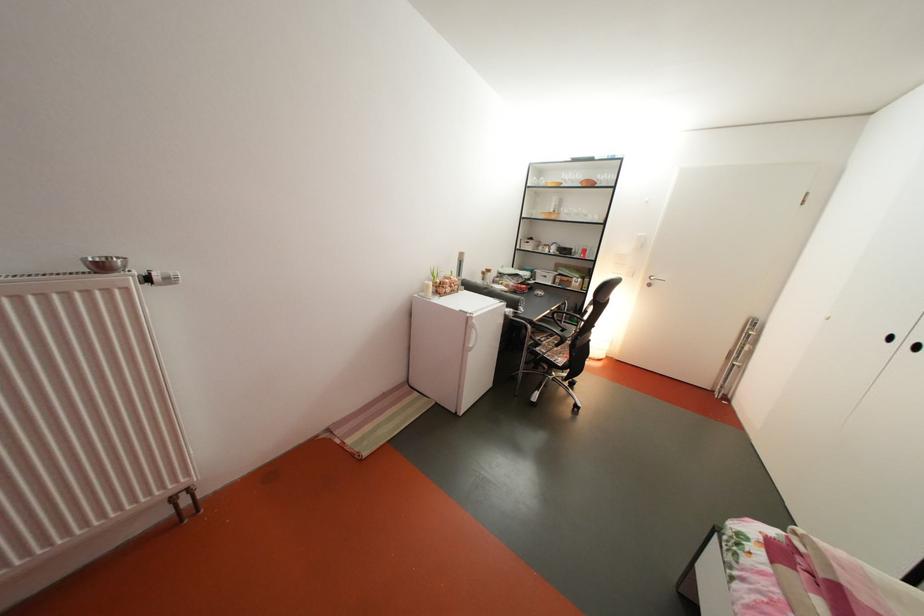
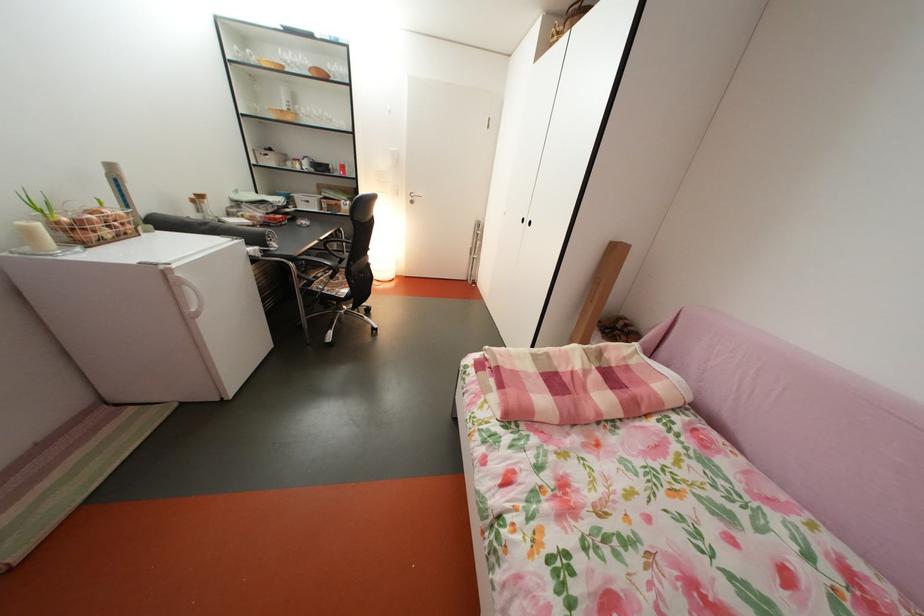
The point at (541, 253) is marked in the first image. Where is the corresponding point in the second image?

(283, 168)